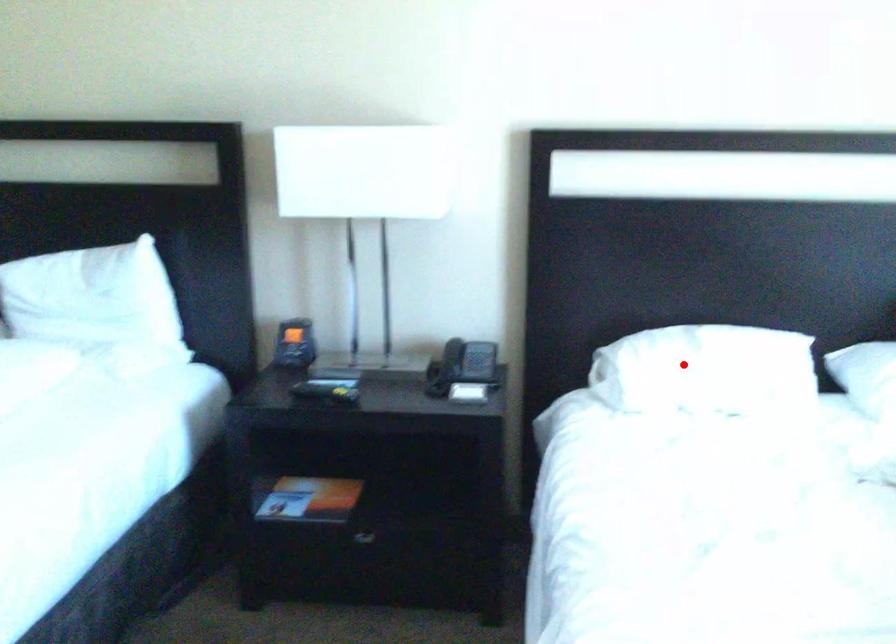
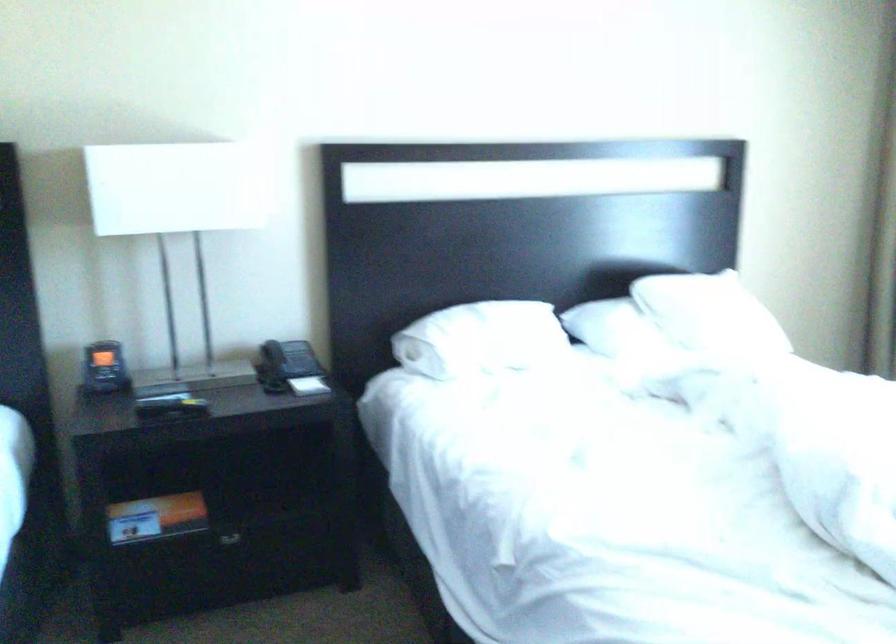
Question: I am providing you with two images of the same scene from different viewpoints. In image1, a red point is highlighted. Considering the same 3D point in image2, which of the following is correct?

Choices:
 (A) It is closer
 (B) It is farther

Answer: (B)